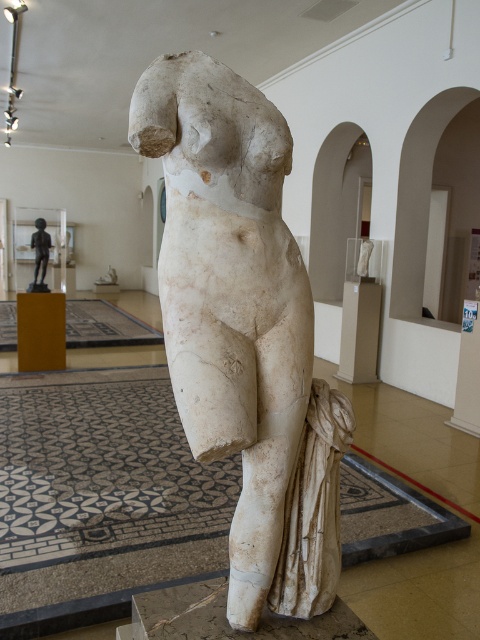
Question: Observing the image, what is the correct spatial positioning of white marble statue at center in reference to bronze figure at left?

Choices:
 (A) right
 (B) left

Answer: (A)

Question: Can you confirm if white marble statue at center is positioned to the right of bronze figure at left?

Choices:
 (A) no
 (B) yes

Answer: (B)

Question: Does white marble statue at center appear on the left side of bronze figure at left?

Choices:
 (A) no
 (B) yes

Answer: (A)

Question: Which of the following is the farthest from the observer?

Choices:
 (A) bronze figure at left
 (B) white marble statue at center

Answer: (A)

Question: Among these objects, which one is farthest from the camera?

Choices:
 (A) bronze figure at left
 (B) white marble statue at center

Answer: (A)

Question: Which object is closer to the camera taking this photo?

Choices:
 (A) white marble statue at center
 (B) bronze figure at left

Answer: (A)